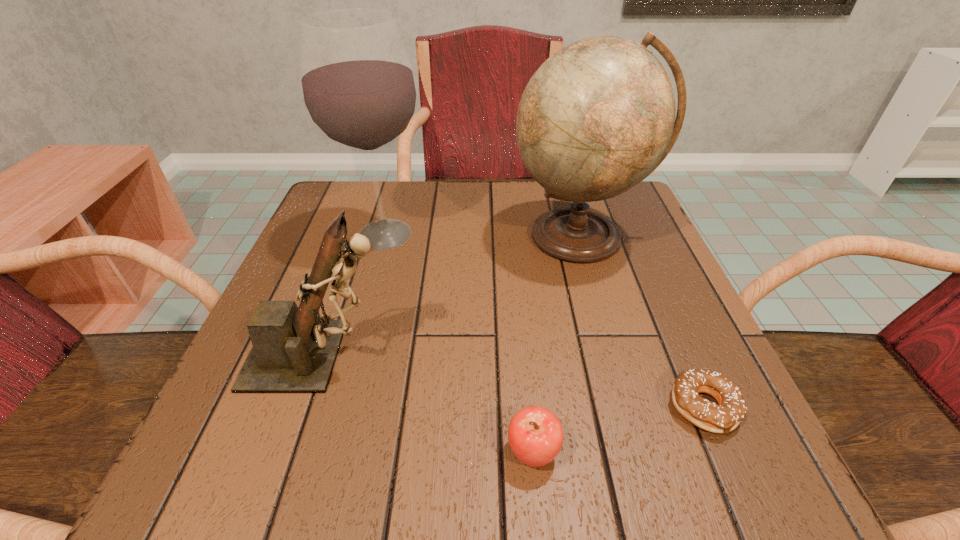
This screenshot has height=540, width=960. What are the coordinates of `alcohol located in the far edge section of the desktop` in the screenshot? It's located at (359, 91).

Where is `globe present at the far edge`? globe present at the far edge is located at coordinates (598, 116).

This screenshot has height=540, width=960. I want to click on apple present at the near edge, so [535, 434].

You are a GUI agent. You are given a task and a screenshot of the screen. Output one action in this format:
    pyautogui.click(x=<x>, y=<y>)
    Task: Click on the doughnut present at the near edge
    The image size is (960, 540).
    Given the screenshot: What is the action you would take?
    pyautogui.click(x=725, y=417)

At what (x,y) coordinates should I click in order to perform the action: click on alcohol positioned at the left edge. Please return your answer as a coordinate pair (x, y). Looking at the image, I should click on (359, 91).

Where is `figurine that is at the left edge`? Image resolution: width=960 pixels, height=540 pixels. figurine that is at the left edge is located at coordinates (294, 350).

You are a GUI agent. You are given a task and a screenshot of the screen. Output one action in this format:
    pyautogui.click(x=<x>, y=<y>)
    Task: Click on the globe at the right edge
    This screenshot has width=960, height=540.
    Given the screenshot: What is the action you would take?
    pyautogui.click(x=598, y=116)

This screenshot has height=540, width=960. I want to click on doughnut located at the right edge, so click(725, 417).

The image size is (960, 540). Find the location of `object at the far left corner`. object at the far left corner is located at coordinates (359, 91).

Find the location of `object that is positioned at the far right corner`. object that is positioned at the far right corner is located at coordinates (598, 116).